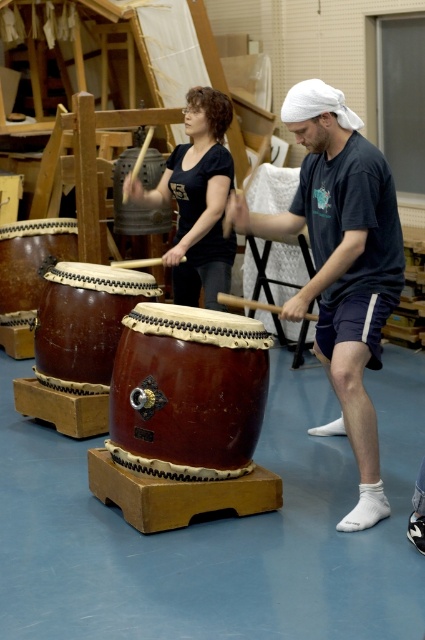
You are a photographer positioned in front of the two taiko drums. You want to capture a closeup shot of the brown leather drum at left without the brown wooden drum at center appearing in the frame. Is this possible given their positions?

The brown leather drum at left is closer to the viewer than the brown wooden drum at center, so if positioned correctly, the photographer can focus on the brown leather drum at left and block the view of the brown wooden drum at center by adjusting the camera angle or moving closer.